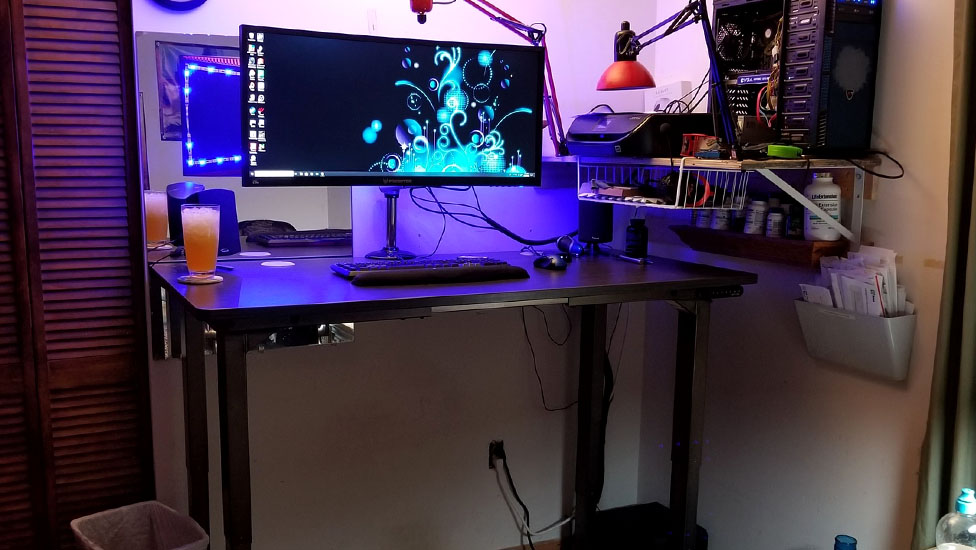
Where is `keyboard`? The width and height of the screenshot is (976, 550). keyboard is located at coordinates (432, 263).